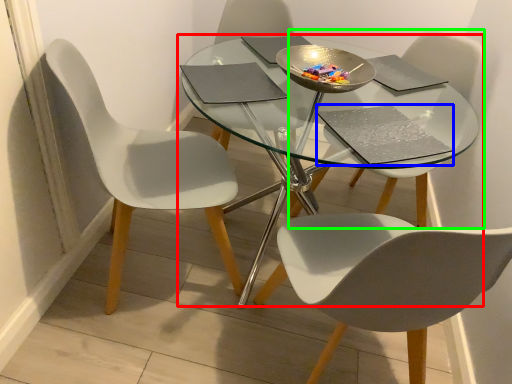
Question: Which object is the farthest from table (highlighted by a red box)? Choose among these: pad (highlighted by a blue box) or chair (highlighted by a green box).

Choices:
 (A) pad
 (B) chair

Answer: (B)